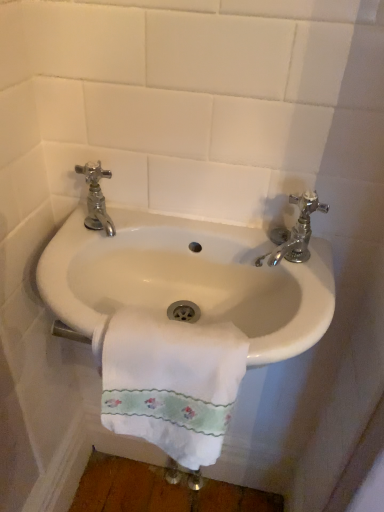
The width and height of the screenshot is (384, 512). Find the location of `vacant area that is in front of chrome/metallic faucet at right, the 2th tap positioned from the left`. vacant area that is in front of chrome/metallic faucet at right, the 2th tap positioned from the left is located at coordinates (297, 304).